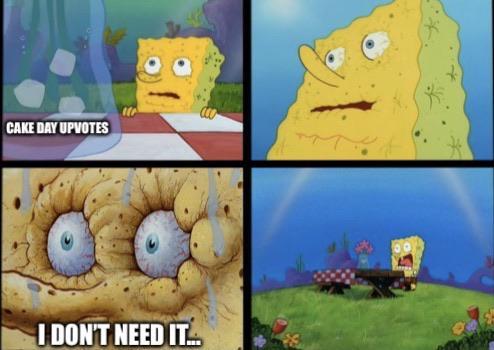
You are a GUI agent. You are given a task and a screenshot of the screen. Output one action in this format:
    pyautogui.click(x=<x>, y=<y>)
    Task: Click on the glass jar
    Image resolution: width=494 pixels, height=350 pixels.
    Given the screenshot: What is the action you would take?
    pyautogui.click(x=86, y=76), pyautogui.click(x=365, y=262)